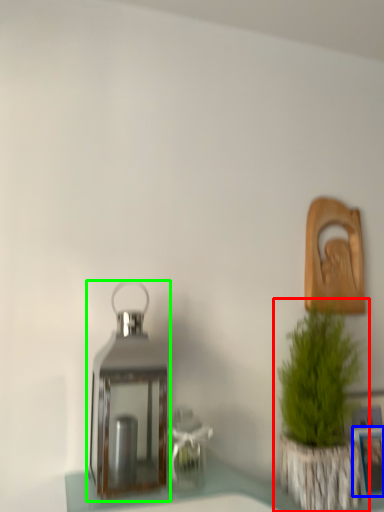
Question: Considering the real-world distances, which object is farthest from houseplant (highlighted by a red box)? picture frame (highlighted by a blue box) or lantern (highlighted by a green box)?

Choices:
 (A) picture frame
 (B) lantern

Answer: (B)